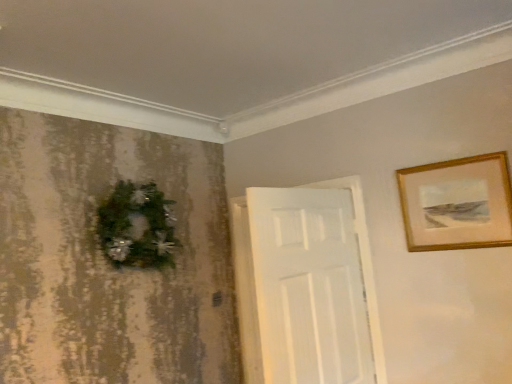
Question: Should I look upward or downward to see gold wooden picture frame at upper right?

Choices:
 (A) down
 (B) up

Answer: (A)

Question: Is gold wooden picture frame at upper right positioned with its back to green matte wreath at left?

Choices:
 (A) no
 (B) yes

Answer: (A)

Question: From the image's perspective, is gold wooden picture frame at upper right beneath green matte wreath at left?

Choices:
 (A) yes
 (B) no

Answer: (B)

Question: Does gold wooden picture frame at upper right have a smaller size compared to green matte wreath at left?

Choices:
 (A) no
 (B) yes

Answer: (B)

Question: Is gold wooden picture frame at upper right positioned behind green matte wreath at left?

Choices:
 (A) no
 (B) yes

Answer: (A)

Question: Can you confirm if gold wooden picture frame at upper right is wider than green matte wreath at left?

Choices:
 (A) no
 (B) yes

Answer: (A)

Question: Can you confirm if gold wooden picture frame at upper right is shorter than green matte wreath at left?

Choices:
 (A) no
 (B) yes

Answer: (B)

Question: From the image's perspective, is green matte wreath at left below gold wooden picture frame at upper right?

Choices:
 (A) yes
 (B) no

Answer: (A)

Question: From a real-world perspective, is green matte wreath at left physically above gold wooden picture frame at upper right?

Choices:
 (A) no
 (B) yes

Answer: (B)

Question: Is green matte wreath at left not inside gold wooden picture frame at upper right?

Choices:
 (A) yes
 (B) no

Answer: (A)

Question: Can you confirm if green matte wreath at left is taller than gold wooden picture frame at upper right?

Choices:
 (A) yes
 (B) no

Answer: (A)

Question: Is green matte wreath at left at the right side of gold wooden picture frame at upper right?

Choices:
 (A) no
 (B) yes

Answer: (A)

Question: Can you confirm if green matte wreath at left is bigger than gold wooden picture frame at upper right?

Choices:
 (A) yes
 (B) no

Answer: (A)

Question: From the image's perspective, is green matte wreath at left positioned above or below gold wooden picture frame at upper right?

Choices:
 (A) above
 (B) below

Answer: (B)